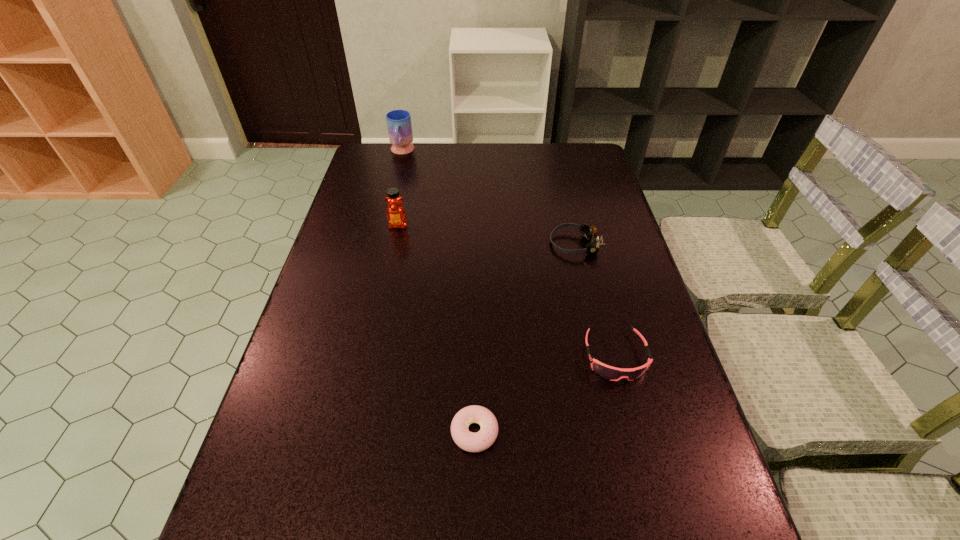
In the image, there is a desktop. Where is `free region at the far right corner`? The height and width of the screenshot is (540, 960). free region at the far right corner is located at coordinates (580, 171).

Locate an element on the screen. free space between the shortest object and the farthest object is located at coordinates (439, 292).

Find the location of a particular element. The width and height of the screenshot is (960, 540). free spot between the mug and the nearer goggles is located at coordinates (509, 254).

The height and width of the screenshot is (540, 960). I want to click on empty location between the honey and the doughnut, so [x=437, y=328].

Find the location of a particular element. The width and height of the screenshot is (960, 540). free space between the doughnut and the honey is located at coordinates [437, 328].

Find the location of a particular element. empty space between the third object from right to left and the nearer goggles is located at coordinates (545, 394).

You are a GUI agent. You are given a task and a screenshot of the screen. Output one action in this format:
    pyautogui.click(x=<x>, y=<y>)
    Task: Click on the free space between the second nearest object and the honey
    The image size is (960, 540).
    Given the screenshot: What is the action you would take?
    pyautogui.click(x=507, y=291)

The image size is (960, 540). What are the coordinates of `vacant area that lies between the farthest object and the nearer goggles` in the screenshot? It's located at (509, 254).

Locate an element on the screen. free space between the fourth farthest object and the doughnut is located at coordinates (545, 394).

What are the coordinates of `free spot between the mug and the honey` in the screenshot? It's located at (400, 188).